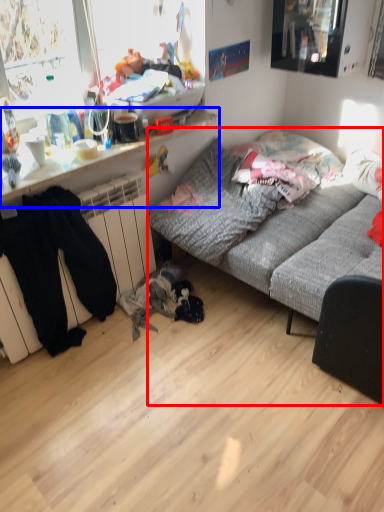
Question: Which of the following is the closest to the observer, studio couch (highlighted by a red box) or desk (highlighted by a blue box)?

Choices:
 (A) studio couch
 (B) desk

Answer: (A)